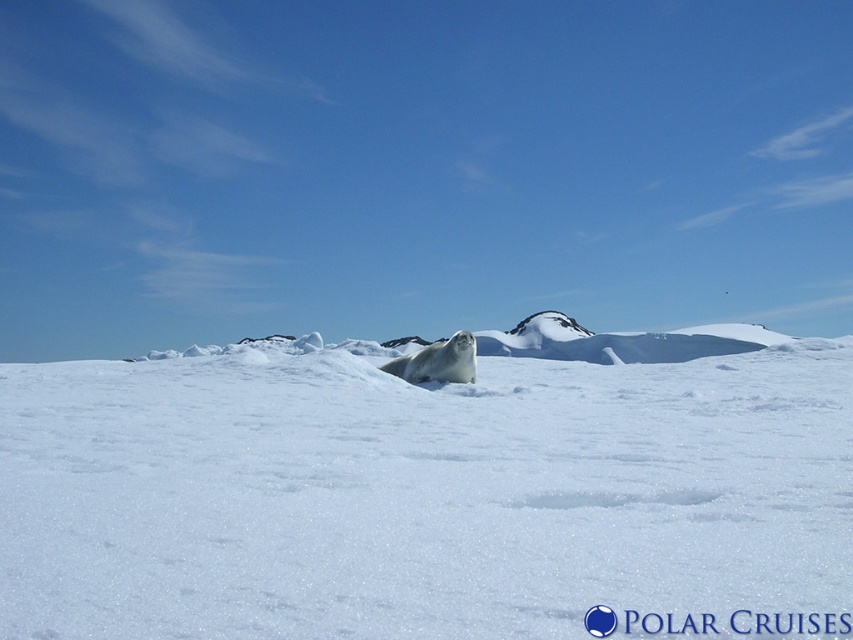
You are standing at the point with coordinates point (454, 348) and want to move towards the seal in the center. Is the point with coordinates point (560, 552) located between you and the seal?

Yes, the point with coordinates point (560, 552) is located between you and the seal because it is in front of point (454, 348), which is your current position.

You are an explorer trying to cross the snow in the image. You see the white fluffy snow at center and the white fur seal at center. Which one has a wider area?

The white fluffy snow at center has a larger width than the white fur seal at center, so the white fluffy snow at center has a wider area.

From the picture: You are an explorer stranded in the snowy landscape and need to reach the seal for help. Given that you can move 12 feet in one minute, how long would it take you to reach the white fur seal at center from the white fluffy snow at center?

The distance between the white fluffy snow at center and the white fur seal at center is 11.95 feet. Since you can move 12 feet in one minute, it would take approximately one minute to reach the seal.